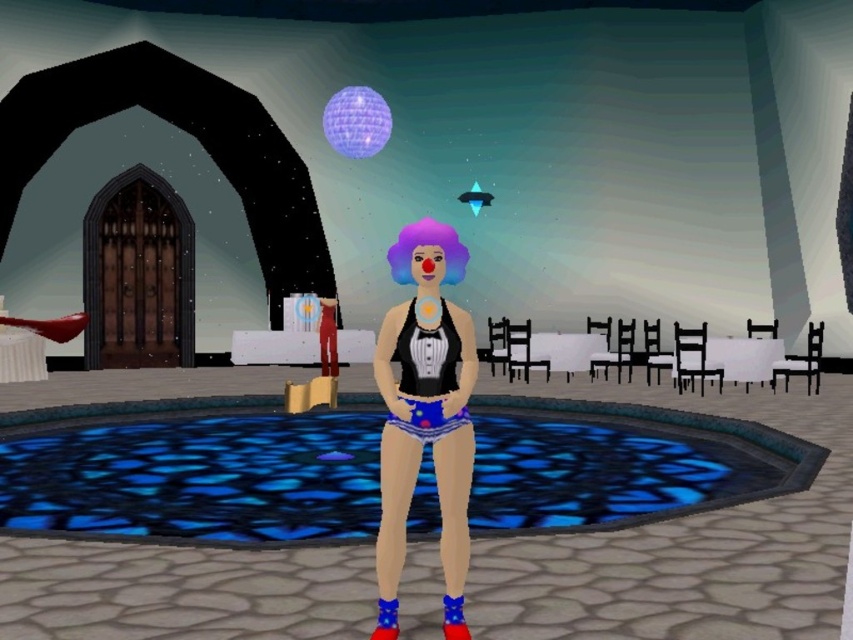
You are navigating a virtual environment and need to reach a checkpoint located at point (465,372). There is an obstacle at point (462,273). Can you safely pass the obstacle to reach your destination?

Point (465,372) is behind point (462,273), so you can safely pass the obstacle at point (462,273) to reach your destination.